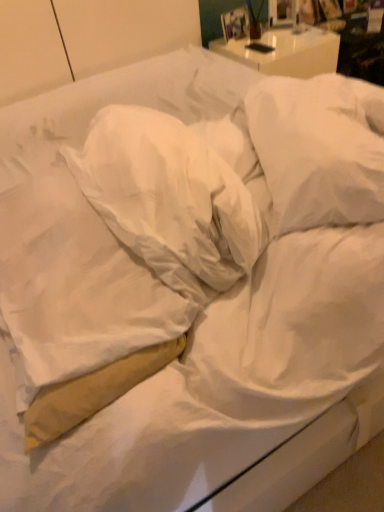
Question: Is white soft pillow at upper right, which appears as the 1th pillow when viewed from the right, in front of white soft pillow at center, the 2th pillow when ordered from right to left?

Choices:
 (A) no
 (B) yes

Answer: (A)

Question: Does white soft pillow at upper right, which is the third pillow from left to right, have a greater width compared to white soft pillow at center, the 2th pillow when ordered from right to left?

Choices:
 (A) yes
 (B) no

Answer: (A)

Question: Is white soft pillow at upper right, which appears as the 1th pillow when viewed from the right, facing away from white soft pillow at center, the 2th pillow when ordered from right to left?

Choices:
 (A) yes
 (B) no

Answer: (A)

Question: From a real-world perspective, does white soft pillow at upper right, which is the third pillow from left to right, stand above white soft pillow at center, which appears as the second pillow when viewed from the left?

Choices:
 (A) no
 (B) yes

Answer: (A)

Question: Considering the relative sizes of white soft pillow at upper right, which appears as the 1th pillow when viewed from the right, and white soft pillow at center, which appears as the second pillow when viewed from the left, in the image provided, is white soft pillow at upper right, which appears as the 1th pillow when viewed from the right, shorter than white soft pillow at center, which appears as the second pillow when viewed from the left,?

Choices:
 (A) no
 (B) yes

Answer: (B)

Question: Does white soft pillow at upper right, which appears as the 1th pillow when viewed from the right, have a smaller size compared to white soft pillow at center, the 2th pillow when ordered from right to left?

Choices:
 (A) yes
 (B) no

Answer: (A)

Question: Can you confirm if white soft pillow at center, the 2th pillow when ordered from right to left, is wider than white soft pillow at upper right, which is the third pillow from left to right?

Choices:
 (A) yes
 (B) no

Answer: (B)

Question: Is white soft pillow at upper right, which appears as the 1th pillow when viewed from the right, completely or partially inside white soft pillow at center, the 2th pillow when ordered from right to left?

Choices:
 (A) yes
 (B) no

Answer: (B)

Question: Is white soft pillow at center, which appears as the second pillow when viewed from the left, facing towards white soft pillow at upper right, which appears as the 1th pillow when viewed from the right?

Choices:
 (A) no
 (B) yes

Answer: (B)

Question: Can you confirm if white soft pillow at center, the 2th pillow when ordered from right to left, is smaller than white soft pillow at upper right, which is the third pillow from left to right?

Choices:
 (A) yes
 (B) no

Answer: (B)

Question: Does white soft pillow at center, which appears as the second pillow when viewed from the left, have a greater height compared to white soft pillow at upper right, which appears as the 1th pillow when viewed from the right?

Choices:
 (A) yes
 (B) no

Answer: (A)

Question: Is white soft pillow at center, the 2th pillow when ordered from right to left, outside of white soft pillow at upper right, which appears as the 1th pillow when viewed from the right?

Choices:
 (A) no
 (B) yes

Answer: (B)

Question: From the image's perspective, is tan fabric pillow at left, placed as the 3th pillow when sorted from right to left, over white soft pillow at upper right, which is the third pillow from left to right?

Choices:
 (A) yes
 (B) no

Answer: (B)